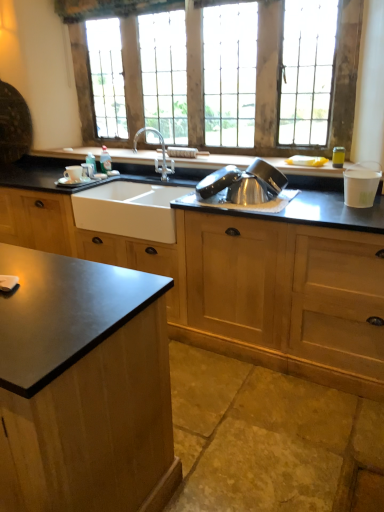
Describe the element at coordinates (105, 160) in the screenshot. I see `clear plastic bottle at sink left` at that location.

The height and width of the screenshot is (512, 384). What are the coordinates of `matte black countertop at center` in the screenshot? It's located at (x=240, y=274).

What do you see at coordinates (130, 210) in the screenshot? I see `white matte sink at center` at bounding box center [130, 210].

Find the location of a particular element. Image resolution: width=384 pixels, height=512 pixels. silver metallic faucet at center is located at coordinates (162, 153).

The image size is (384, 512). What are the coordinates of `clear plastic bottle at sink left` in the screenshot? It's located at (105, 160).

Can you see silver metallic faucet at center touching matte black countertop at center?

They are not placed beside each other.

Is point (142, 129) closer or farther from the camera than point (249, 280)?

Point (142, 129) is farther from the camera than point (249, 280).

From a real-world perspective, relative to matte black countertop at center, is silver metallic faucet at center vertically above or below?

In terms of real-world spatial position, silver metallic faucet at center is above matte black countertop at center.

Measure the distance between yellow plastic coffee maker at right and silver metallic faucet at center.

A distance of 3.76 feet exists between yellow plastic coffee maker at right and silver metallic faucet at center.

Can you tell me how much yellow plastic coffee maker at right and silver metallic faucet at center differ in facing direction?

The angle between the facing direction of yellow plastic coffee maker at right and the facing direction of silver metallic faucet at center is 0.026 degrees.

Looking at this image, considering the relative sizes of yellow plastic coffee maker at right and silver metallic faucet at center in the image provided, is yellow plastic coffee maker at right thinner than silver metallic faucet at center?

Yes.

Is silver metallic faucet at center at the back of yellow plastic coffee maker at right?

No, yellow plastic coffee maker at right is not facing the opposite direction of silver metallic faucet at center.

Is white paper cup at right, which is counted as the 1th appliance, starting from the right, touching matte white cup at sink?

There is a gap between white paper cup at right, which is counted as the 1th appliance, starting from the right, and matte white cup at sink.

Looking at this image, can you confirm if white paper cup at right, which is counted as the 1th appliance, starting from the right, is bigger than matte white cup at sink?

Yes.

Where is `the 2nd appliance below the matte white cup at sink (from the image's perspective)`? Image resolution: width=384 pixels, height=512 pixels. the 2nd appliance below the matte white cup at sink (from the image's perspective) is located at coordinates (361, 184).

Can you confirm if white paper cup at right, which is counted as the 1th appliance, starting from the right, is wider than matte white cup at sink?

Correct, the width of white paper cup at right, which is counted as the 1th appliance, starting from the right, exceeds that of matte white cup at sink.

Looking at this image, considering the relative positions of matte black countertop at center and satin silver bowl at center, acting as the 2th appliance starting from the right, in the image provided, is matte black countertop at center to the left of satin silver bowl at center, acting as the 2th appliance starting from the right, from the viewer's perspective?

Yes.

Are matte black countertop at center and satin silver bowl at center, marked as the first appliance in a left-to-right arrangement, making contact?

No.

Considering the sizes of objects matte black countertop at center and satin silver bowl at center, acting as the 2th appliance starting from the right, in the image provided, who is smaller, matte black countertop at center or satin silver bowl at center, acting as the 2th appliance starting from the right,?

satin silver bowl at center, acting as the 2th appliance starting from the right.

Is matte black countertop at center facing away from satin silver bowl at center, marked as the first appliance in a left-to-right arrangement?

No, matte black countertop at center's orientation is not away from satin silver bowl at center, marked as the first appliance in a left-to-right arrangement.

Is white matte sink at center wider or thinner than wooden window at upper center?

In the image, white matte sink at center appears to be wider than wooden window at upper center.

From a real-world perspective, is white matte sink at center physically located above or below wooden window at upper center?

white matte sink at center is below wooden window at upper center.

How many degrees apart are the facing directions of white matte sink at center and wooden window at upper center?

1.04 degrees separate the facing orientations of white matte sink at center and wooden window at upper center.

From the image's perspective, between white matte sink at center and wooden window at upper center, which one is located above?

wooden window at upper center, from the image's perspective.

Looking at this image, does matte black countertop at center have a lesser height compared to wooden window at upper center?

Yes, matte black countertop at center is shorter than wooden window at upper center.

Between matte black countertop at center and wooden window at upper center, which one is positioned in front?

matte black countertop at center is closer to the camera.

Is matte black countertop at center directly adjacent to wooden window at upper center?

No, matte black countertop at center is not in contact with wooden window at upper center.

Between wooden window at upper center and yellow plastic coffee maker at right, which one has smaller size?

yellow plastic coffee maker at right is smaller.

From a real-world perspective, is wooden window at upper center beneath yellow plastic coffee maker at right?

No, from a real-world perspective, wooden window at upper center is not beneath yellow plastic coffee maker at right.

How distant is wooden window at upper center from yellow plastic coffee maker at right?

wooden window at upper center is 17.45 inches away from yellow plastic coffee maker at right.

Where is `window above the yellow plastic coffee maker at right (from a real-world perspective)`? window above the yellow plastic coffee maker at right (from a real-world perspective) is located at coordinates (270, 82).

The height and width of the screenshot is (512, 384). I want to click on cabinetry that is on the left side of silver metallic faucet at center, so click(x=240, y=274).

Locate an element on the screen. tap behind the yellow plastic coffee maker at right is located at coordinates (162, 153).

Estimate the real-world distances between objects in this image. Which object is closer to white paper cup at right, which is counted as the 2th appliance, starting from the left, clear plastic bottle at sink left or wooden window at upper center?

wooden window at upper center is positioned closer to the anchor white paper cup at right, which is counted as the 2th appliance, starting from the left.

When comparing their distances from matte white cup at sink, does clear plastic bottle at sink left or white matte sink at center seem further?

The object further to matte white cup at sink is white matte sink at center.

Which object lies further to the anchor point matte black countertop at center, white matte sink at center or satin silver bowl at center, marked as the first appliance in a left-to-right arrangement?

Based on the image, satin silver bowl at center, marked as the first appliance in a left-to-right arrangement, appears to be further to matte black countertop at center.

Considering their positions, is matte white cup at sink positioned further to yellow plastic coffee maker at right than clear plastic bottle at sink left?

Among the two, matte white cup at sink is located further to yellow plastic coffee maker at right.

From the image, which object appears to be farther from white paper cup at right, which is counted as the 1th appliance, starting from the right, satin silver bowl at center, marked as the first appliance in a left-to-right arrangement, or matte white cup at sink?

matte white cup at sink.

Which object lies nearer to the anchor point silver metallic faucet at center, satin silver bowl at center, acting as the 2th appliance starting from the right, or matte black countertop at center?

satin silver bowl at center, acting as the 2th appliance starting from the right.

When comparing their distances from clear plastic bottle at sink left, does satin silver bowl at center, marked as the first appliance in a left-to-right arrangement, or wooden window at upper center seem closer?

satin silver bowl at center, marked as the first appliance in a left-to-right arrangement, is closer to clear plastic bottle at sink left.

Considering their positions, is yellow plastic coffee maker at right positioned further to matte black countertop at center than clear plastic bottle at sink left?

clear plastic bottle at sink left is positioned further to the anchor matte black countertop at center.

In order to click on coffee cup positioned between matte black countertop at center and clear plastic bottle at sink left from near to far in this screenshot , I will do `click(73, 173)`.

Locate an element on the screen. The width and height of the screenshot is (384, 512). cabinetry between matte white cup at sink and yellow plastic coffee maker at right in the horizontal direction is located at coordinates (240, 274).

Identify the location of window between clear plastic bottle at sink left and satin silver bowl at center, acting as the 2th appliance starting from the right. pos(270,82).

This screenshot has height=512, width=384. Find the location of `bottle situated between matte white cup at sink and wooden window at upper center from left to right`. bottle situated between matte white cup at sink and wooden window at upper center from left to right is located at coordinates (105, 160).